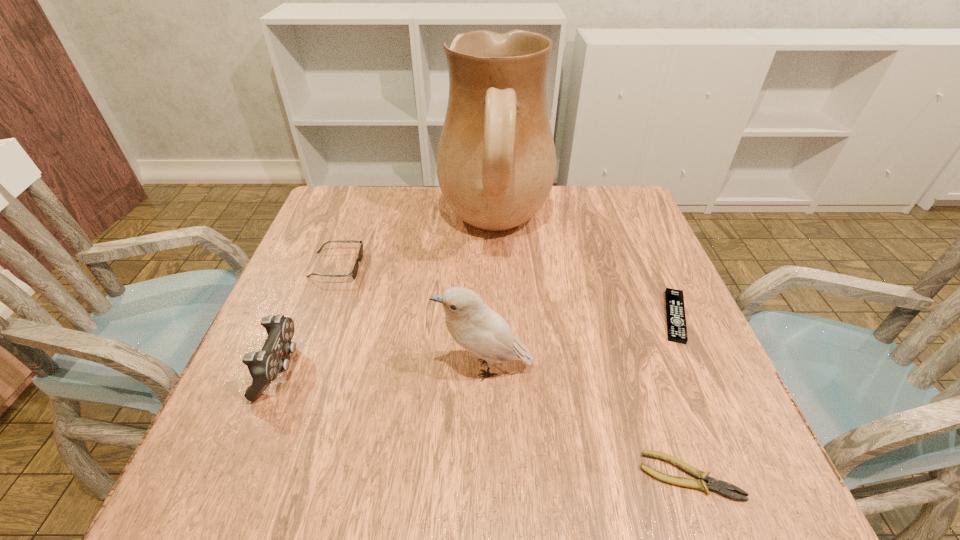
Identify the location of unoccupied area between the fifth shortest object and the control. Image resolution: width=960 pixels, height=540 pixels. (382, 368).

Locate an element on the screen. free space between the fifth shortest object and the sunglasses is located at coordinates (410, 317).

Find the location of a particular element. This screenshot has height=540, width=960. vacant space that is in between the fifth shortest object and the sunglasses is located at coordinates (410, 317).

This screenshot has height=540, width=960. In order to click on vacant space that's between the nearest object and the control in this screenshot , I will do `click(485, 422)`.

Locate an element on the screen. The height and width of the screenshot is (540, 960). blank region between the third shortest object and the bird is located at coordinates (410, 317).

Find the location of a particular element. unoccupied position between the pliers and the fourth shortest object is located at coordinates (485, 422).

Find the location of a particular element. vacant space that is in between the second tallest object and the third shortest object is located at coordinates (410, 317).

Image resolution: width=960 pixels, height=540 pixels. In order to click on free space that is in between the pliers and the remote control in this screenshot , I will do `click(683, 396)`.

In order to click on unoccupied position between the sunglasses and the nearest object in this screenshot , I will do `click(513, 371)`.

Identify which object is the fourth closest to the sunglasses. Please provide its 2D coordinates. Your answer should be formatted as a tuple, i.e. [(x, y)], where the tuple contains the x and y coordinates of a point satisfying the conditions above.

[(675, 310)]